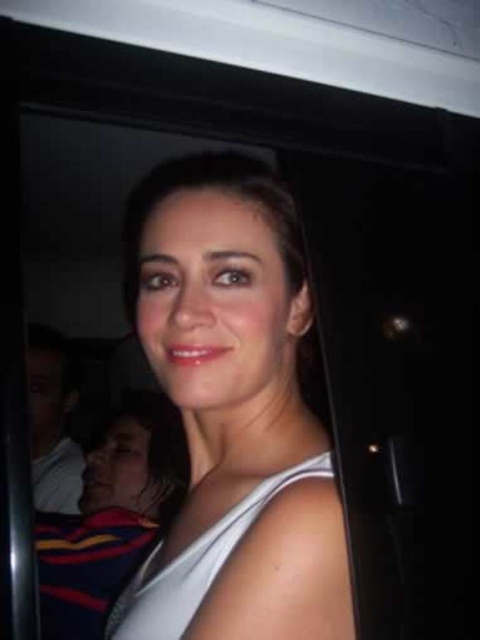
Question: Does striped jersey at lower left have a smaller size compared to white matte dress at center?

Choices:
 (A) yes
 (B) no

Answer: (B)

Question: Is striped jersey at lower left to the left of white matte dress at center from the viewer's perspective?

Choices:
 (A) no
 (B) yes

Answer: (B)

Question: Which point is farther from the camera taking this photo?

Choices:
 (A) (194, 550)
 (B) (70, 614)
 (C) (214, 634)

Answer: (B)

Question: Which of the following is the farthest from the observer?

Choices:
 (A) striped jersey at lower left
 (B) white matte tank top at center
 (C) white matte dress at center

Answer: (A)

Question: Among these points, which one is nearest to the camera?

Choices:
 (A) (181, 268)
 (B) (291, 477)
 (C) (187, 456)

Answer: (B)

Question: Does white matte tank top at center appear over striped jersey at lower left?

Choices:
 (A) yes
 (B) no

Answer: (A)